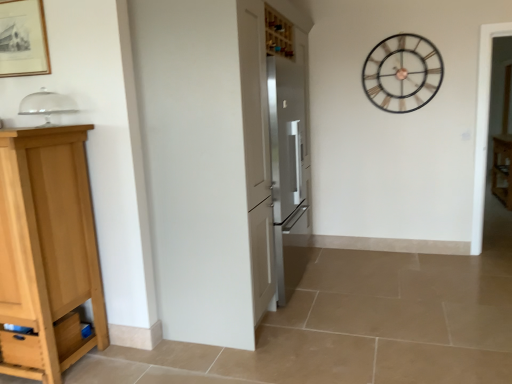
Question: In the image, is wooden cabinet at right, which ranks as the 2th cabinetry in left-to-right order, positioned in front of or behind wooden picture frame at upper left?

Choices:
 (A) front
 (B) behind

Answer: (B)

Question: From a real-world perspective, relative to wooden picture frame at upper left, is wooden cabinet at right, which ranks as the 2th cabinetry in left-to-right order, vertically above or below?

Choices:
 (A) below
 (B) above

Answer: (A)

Question: Which of these objects is positioned farthest from the metallic gold clock at upper right?

Choices:
 (A) wooden picture frame at upper left
 (B) clear glass dome at upper left, the 1th appliance when ordered from front to back
 (C) light wood cabinet at left, the first cabinetry in the left-to-right sequence
 (D) satin silver refrigerator at center, acting as the 1th appliance starting from the back
 (E) wooden cabinet at right, placed as the first cabinetry when sorted from back to front

Answer: (C)

Question: Which object is the farthest from the wooden picture frame at upper left?

Choices:
 (A) wooden cabinet at right, which ranks as the 2th cabinetry in left-to-right order
 (B) clear glass dome at upper left, the 1th appliance when ordered from front to back
 (C) metallic gold clock at upper right
 (D) satin silver refrigerator at center, the 1th appliance from the right
 (E) light wood cabinet at left, the first cabinetry in the left-to-right sequence

Answer: (A)